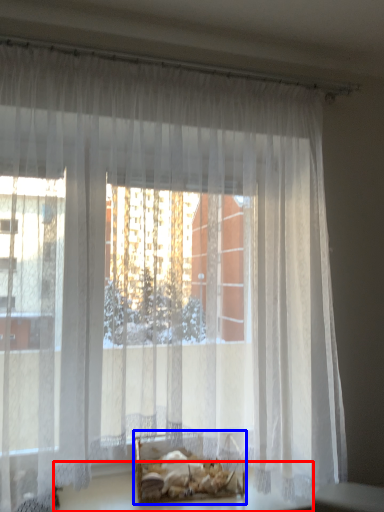
Question: Which object is further to the camera taking this photo, table (highlighted by a red box) or bed (highlighted by a blue box)?

Choices:
 (A) table
 (B) bed

Answer: (B)